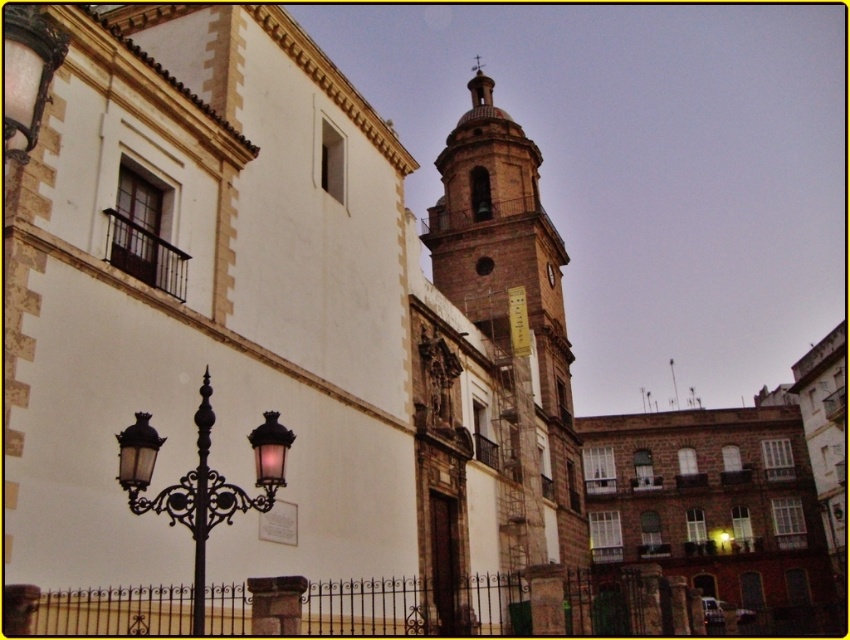
You are standing at the entrance of the historic building and want to take a photo of the brown stone clock tower at center. Which direction should you face to ensure the clock tower is in the center of your photo?

You should face directly towards the brown stone clock tower at center since it is located at the center point of the scene, specifically at coordinates (490, 376).

You are standing in front of a historic building complex. You see a brown stone church at center and a brown stone clock tower at center. Which one is positioned more to the left?

The brown stone church at center is positioned to the left of the brown stone clock tower at center, so the brown stone church at center is more to the left.